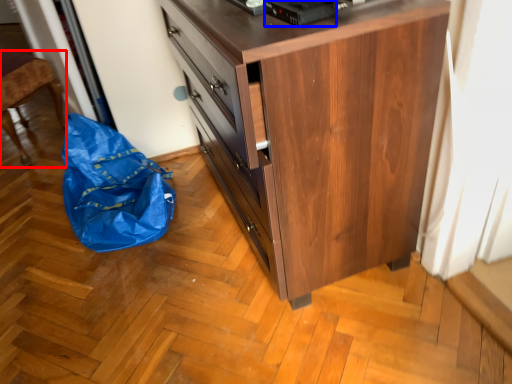
Question: Which point is closer to the camera, furniture (highlighted by a red box) or appliance (highlighted by a blue box)?

Choices:
 (A) furniture
 (B) appliance

Answer: (B)